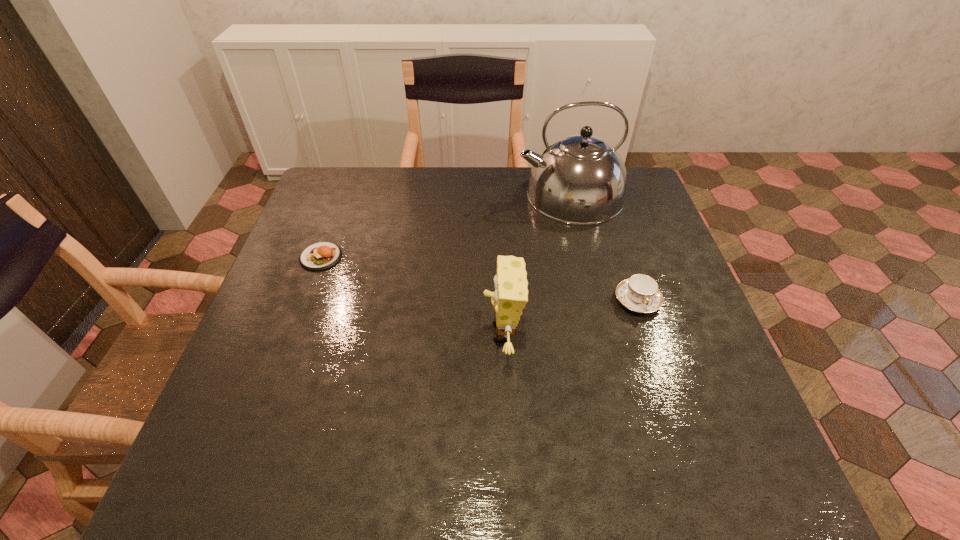
Identify the location of empty space between the farthest object and the teacup. (604, 248).

Where is `free space between the third object from right to left and the second farthest object`? The image size is (960, 540). free space between the third object from right to left and the second farthest object is located at coordinates (412, 294).

Identify the location of vacant point located between the leftmost object and the sponge. (412, 294).

I want to click on empty space that is in between the sponge and the teacup, so click(x=570, y=316).

Where is `unoccupied position between the shortest object and the tallest object`? This screenshot has width=960, height=540. unoccupied position between the shortest object and the tallest object is located at coordinates (445, 226).

The height and width of the screenshot is (540, 960). I want to click on free spot between the third object from right to left and the kettle, so click(537, 264).

Point out which object is positioned as the nearest to the second shortest object. Please provide its 2D coordinates. Your answer should be formatted as a tuple, i.e. [(x, y)], where the tuple contains the x and y coordinates of a point satisfying the conditions above.

[(580, 179)]

The width and height of the screenshot is (960, 540). Find the location of `object that ranks as the closest to the farthest object`. object that ranks as the closest to the farthest object is located at coordinates (640, 293).

Locate an element on the screen. free space in the image that satisfies the following two spatial constraints: 1. on the side with the handle of the third tallest object; 2. on the face of the second tallest object is located at coordinates (648, 332).

Where is `vacant space that satisfies the following two spatial constraints: 1. on the side with the handle of the third tallest object; 2. on the face of the second tallest object`? vacant space that satisfies the following two spatial constraints: 1. on the side with the handle of the third tallest object; 2. on the face of the second tallest object is located at coordinates (648, 332).